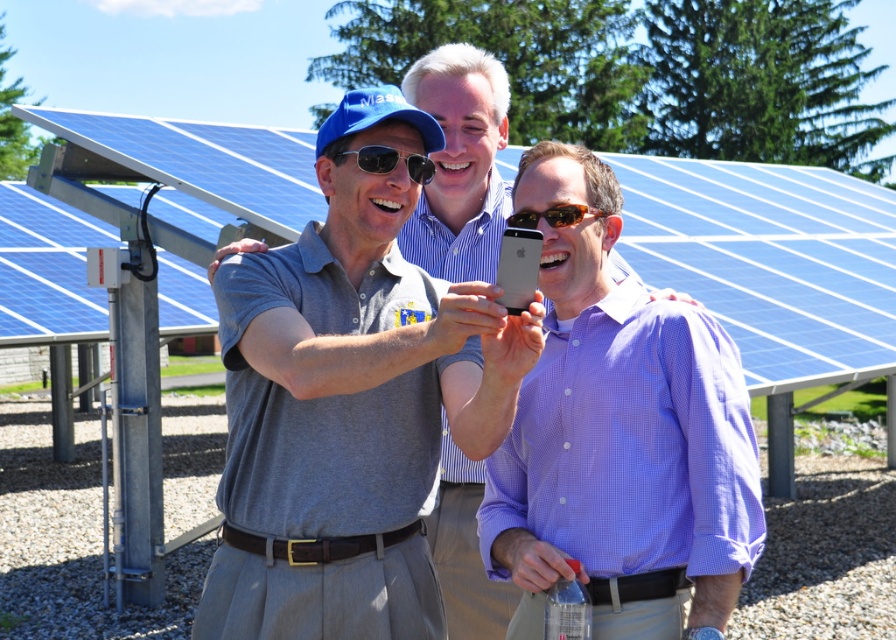
You are a photographer standing 5 feet away from the purple checkered shirt at center and the matte gray shirt at center. Can you capture both of them in a single frame without moving the camera? Explain your reasoning.

The distance between the purple checkered shirt at center and the matte gray shirt at center is 4.20 feet. Since you are 5 feet away from both, the total distance between them is less than the camera frame width at that distance, so yes, both can be captured in one frame.

You are trying to take a photo of the matte gray shirt at center and the matte black sunglasses at center. Which one should you focus on first if you want to ensure both are in focus?

The matte gray shirt at center is much taller than the matte black sunglasses at center, so you should focus on the matte gray shirt at center first to ensure both are in focus.

You are a photographer trying to capture a clear photo of the blue solar panel at center and the brown reflective sunglasses at center. Since both are at the center, which one would appear bigger in the photo?

The blue solar panel at center appears bigger in the photo because it has a larger size compared to the brown reflective sunglasses at center.